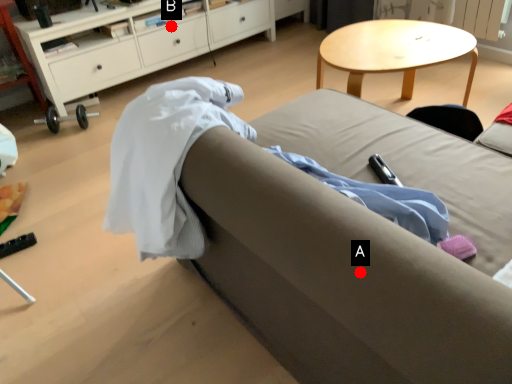
Question: Two points are circled on the image, labeled by A and B beside each circle. Which point is farther to the camera?

Choices:
 (A) A is further
 (B) B is further

Answer: (B)